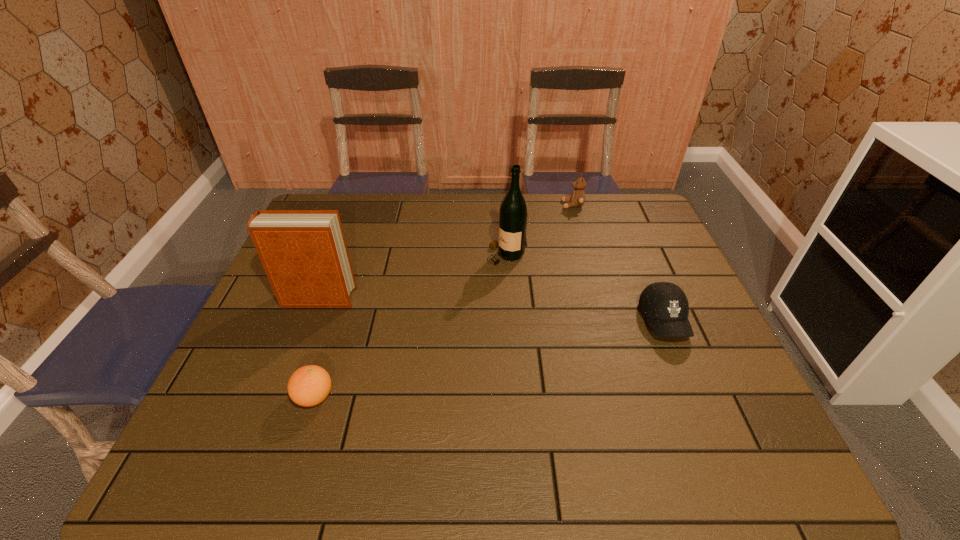
Identify the location of free region located on the open cover of the hardback book. The image size is (960, 540). (464, 298).

Locate an element on the screen. free space located on the front-facing side of the farthest object is located at coordinates (454, 205).

At what (x,y) coordinates should I click in order to perform the action: click on vacant region located 0.200m on the front-facing side of the farthest object. Please return your answer as a coordinate pair (x, y). Image resolution: width=960 pixels, height=540 pixels. Looking at the image, I should click on (505, 205).

Identify the location of vacant space located 0.310m on the front-facing side of the farthest object. point(474,205).

Identify the location of vacant space located on the front-facing side of the rightmost object. pos(718,452).

At what (x,y) coordinates should I click in order to perform the action: click on free space located on the right of the nearest object. Please return your answer as a coordinate pair (x, y). Image resolution: width=960 pixels, height=540 pixels. Looking at the image, I should click on point(496,397).

Identify the location of object that is at the far edge. (577, 199).

This screenshot has height=540, width=960. I want to click on object located at the left edge, so point(304,253).

Where is `object situated at the right edge`? The image size is (960, 540). object situated at the right edge is located at coordinates (665, 305).

You are a GUI agent. You are given a task and a screenshot of the screen. Output one action in this format:
    pyautogui.click(x=<x>, y=<y>)
    Task: Click on the vacant space at the far edge of the desktop
    This screenshot has width=960, height=540.
    Given the screenshot: What is the action you would take?
    pyautogui.click(x=468, y=211)